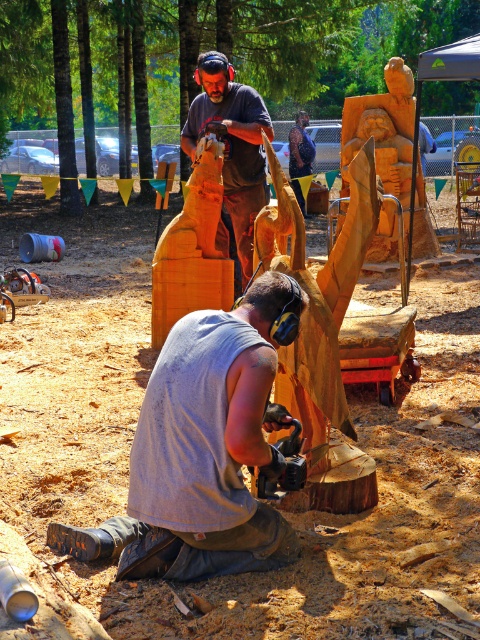
You are a safety inspector visiting this workshop. You need to ensure that the gray fabric squat at lower center and the matte brown wood carving at upper center are placed safely. According to safety guidelines, objects at lower levels should not extend beyond the base of upper objects to prevent tipping. Can you determine if the placement is safe?

The gray fabric squat at lower center might be wider than the matte brown wood carving at upper center, so it could extend beyond the base of the upper object. This might violate safety guidelines and pose a tipping risk. Further measurement is needed to confirm.